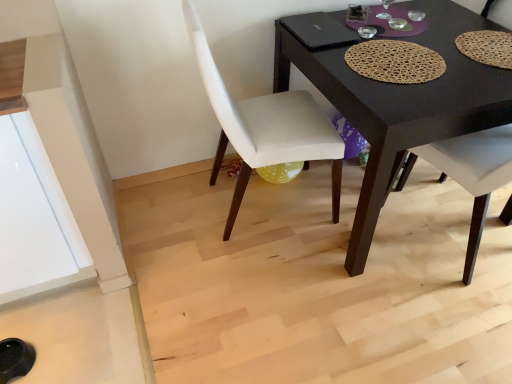
Question: Can you confirm if white fabric chair at center, arranged as the 1th chair when viewed from the left, is shorter than black matte desk at center?

Choices:
 (A) yes
 (B) no

Answer: (B)

Question: Is white fabric chair at center, the second chair viewed from the right, facing towards black matte desk at center?

Choices:
 (A) yes
 (B) no

Answer: (A)

Question: Is white fabric chair at center, the second chair viewed from the right, closer to the viewer compared to black matte desk at center?

Choices:
 (A) yes
 (B) no

Answer: (A)

Question: From a real-world perspective, is white fabric chair at center, the second chair viewed from the right, physically above black matte desk at center?

Choices:
 (A) yes
 (B) no

Answer: (A)

Question: Is white fabric chair at center, the second chair viewed from the right, to the right of black matte desk at center from the viewer's perspective?

Choices:
 (A) no
 (B) yes

Answer: (A)

Question: Is white fabric chair at center, the second chair viewed from the right, in front of or behind matte woven placemat at upper right, the second chair in the left-to-right sequence, in the image?

Choices:
 (A) behind
 (B) front

Answer: (B)

Question: Would you say white fabric chair at center, arranged as the 1th chair when viewed from the left, is to the left or to the right of matte woven placemat at upper right, the second chair in the left-to-right sequence, in the picture?

Choices:
 (A) left
 (B) right

Answer: (A)

Question: From a real-world perspective, relative to matte woven placemat at upper right, which is counted as the first chair, starting from the right, is white fabric chair at center, arranged as the 1th chair when viewed from the left, vertically above or below?

Choices:
 (A) above
 (B) below

Answer: (A)

Question: Looking at the image, does white fabric chair at center, arranged as the 1th chair when viewed from the left, seem bigger or smaller compared to matte woven placemat at upper right, which is counted as the first chair, starting from the right?

Choices:
 (A) big
 (B) small

Answer: (B)

Question: Looking at their shapes, would you say matte woven placemat at upper right, which is counted as the first chair, starting from the right, is wider or thinner than brown woven placemat at center?

Choices:
 (A) wide
 (B) thin

Answer: (A)

Question: Would you say matte woven placemat at upper right, which is counted as the first chair, starting from the right, is inside or outside brown woven placemat at center?

Choices:
 (A) inside
 (B) outside

Answer: (B)

Question: Relative to brown woven placemat at center, is matte woven placemat at upper right, which is counted as the first chair, starting from the right, in front or behind?

Choices:
 (A) behind
 (B) front

Answer: (A)

Question: In terms of size, does matte woven placemat at upper right, the second chair in the left-to-right sequence, appear bigger or smaller than brown woven placemat at center?

Choices:
 (A) small
 (B) big

Answer: (B)

Question: Looking at their shapes, would you say brown woven placemat at center is wider or thinner than matte woven placemat at upper right, the second chair in the left-to-right sequence?

Choices:
 (A) wide
 (B) thin

Answer: (B)

Question: From the image's perspective, is brown woven placemat at center positioned above or below matte woven placemat at upper right, the second chair in the left-to-right sequence?

Choices:
 (A) above
 (B) below

Answer: (B)